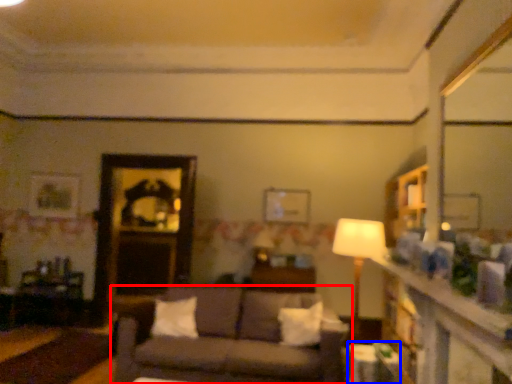
Question: Which object appears closest to the camera in this image, studio couch (highlighted by a red box) or table (highlighted by a blue box)?

Choices:
 (A) studio couch
 (B) table

Answer: (B)